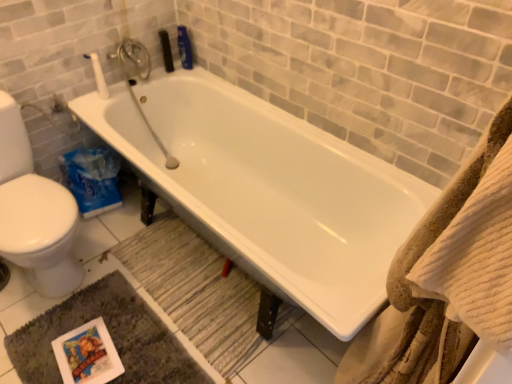
At what (x,y) coordinates should I click in order to perform the action: click on empty space that is ontop of wooden textured bath mat at lower center, which is the first bath mat in top-to-bottom order (from a real-world perspective). Please return your answer as a coordinate pair (x, y). The height and width of the screenshot is (384, 512). Looking at the image, I should click on (199, 282).